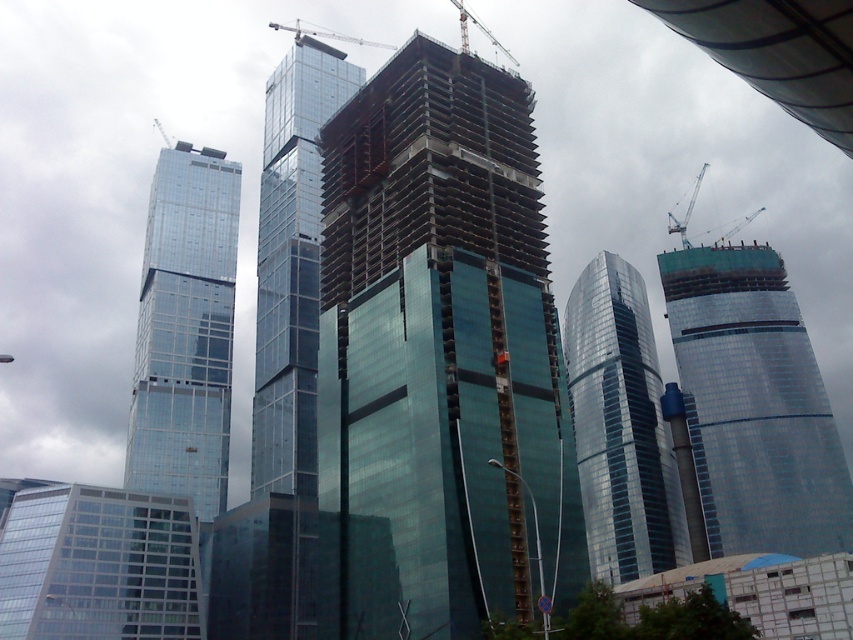
Question: Among these points, which one is farthest from the camera?

Choices:
 (A) (708, 371)
 (B) (341, 36)
 (C) (674, 225)

Answer: (B)

Question: Is green glass building at right above metallic gray crane at upper center?

Choices:
 (A) no
 (B) yes

Answer: (A)

Question: Which of these objects is positioned farthest from the green glass building at center?

Choices:
 (A) glassy steel skyscraper at center
 (B) clear glass building at lower left
 (C) shiny glass skyscraper at left
 (D) metallic gray crane at upper right

Answer: (D)

Question: Can you confirm if green glass building at center is thinner than clear glass building at lower left?

Choices:
 (A) no
 (B) yes

Answer: (B)

Question: Is green glass building at right to the left of metallic gray crane at center from the viewer's perspective?

Choices:
 (A) yes
 (B) no

Answer: (B)

Question: Which of the following is the closest to the observer?

Choices:
 (A) (222, 234)
 (B) (503, 51)
 (C) (758, 212)
 (D) (108, 570)

Answer: (D)